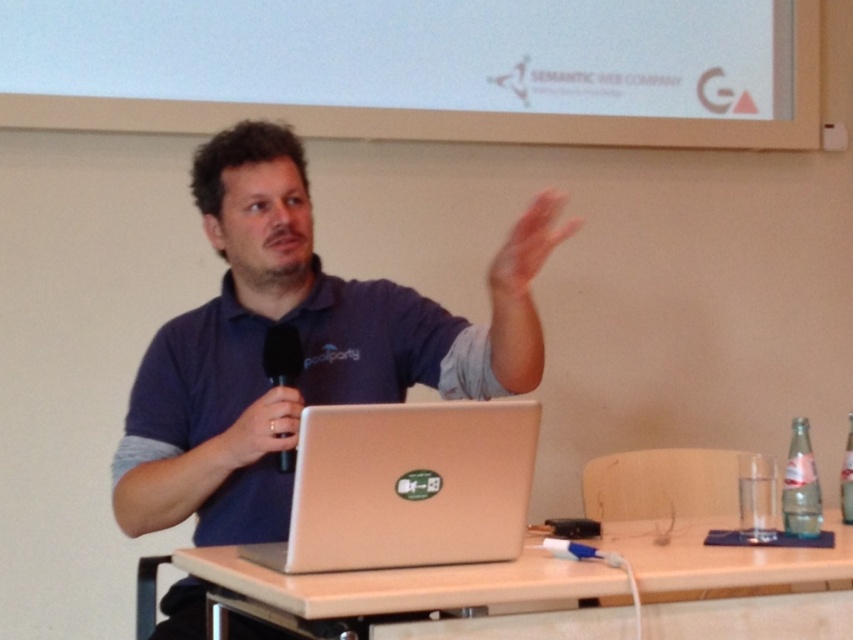
Which is more to the left, matte black microphone at center or black matte microphone at center?

Positioned to the left is matte black microphone at center.

Does matte black microphone at center appear under black matte microphone at center?

Correct, matte black microphone at center is located below black matte microphone at center.

The height and width of the screenshot is (640, 853). I want to click on matte black microphone at center, so click(259, 429).

Between matte blue shirt at center and matte black microphone at center, which one is positioned higher?

matte blue shirt at center is above.

Which is behind, point (245, 340) or point (268, 451)?

The point (245, 340) is behind.

Where is `matte blue shirt at center`? matte blue shirt at center is located at coordinates (300, 346).

Is point (396, 588) more distant than point (277, 460)?

No, (396, 588) is closer to viewer.

Based on the photo, who is lower down, light wood table at center or black matte microphone at center?

light wood table at center is lower down.

Image resolution: width=853 pixels, height=640 pixels. Describe the element at coordinates (399, 582) in the screenshot. I see `light wood table at center` at that location.

This screenshot has width=853, height=640. I want to click on light wood table at center, so click(x=399, y=582).